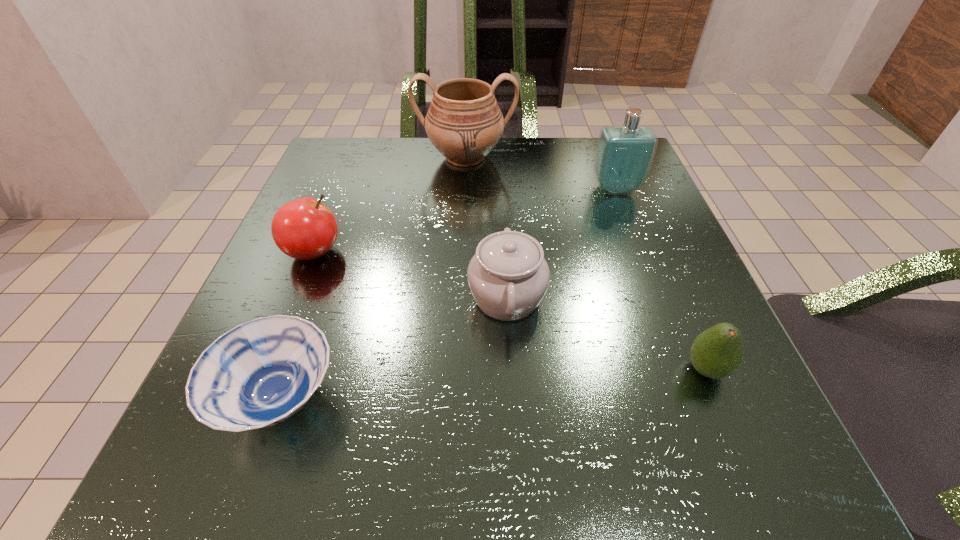
The width and height of the screenshot is (960, 540). What are the coordinates of `vacant area that lies between the perfume and the shortest object` in the screenshot? It's located at (447, 294).

The width and height of the screenshot is (960, 540). In order to click on free spot between the shortest object and the perfume in this screenshot , I will do `click(447, 294)`.

Where is `unoccupied position between the second farthest object and the soup bowl`? The width and height of the screenshot is (960, 540). unoccupied position between the second farthest object and the soup bowl is located at coordinates (447, 294).

Image resolution: width=960 pixels, height=540 pixels. I want to click on object that stands as the closest to the perfume, so click(x=464, y=122).

Identify which object is the closest to the apple. Please provide its 2D coordinates. Your answer should be formatted as a tuple, i.e. [(x, y)], where the tuple contains the x and y coordinates of a point satisfying the conditions above.

[(260, 373)]

The width and height of the screenshot is (960, 540). I want to click on vacant region that satisfies the following two spatial constraints: 1. on the front label of the perfume; 2. on the left side of the avocado, so click(685, 369).

I want to click on vacant space that satisfies the following two spatial constraints: 1. on the front label of the perfume; 2. on the left side of the avocado, so click(x=685, y=369).

Find the location of a particular element. The height and width of the screenshot is (540, 960). free location that satisfies the following two spatial constraints: 1. on the front label of the avocado; 2. on the right side of the second farthest object is located at coordinates (685, 369).